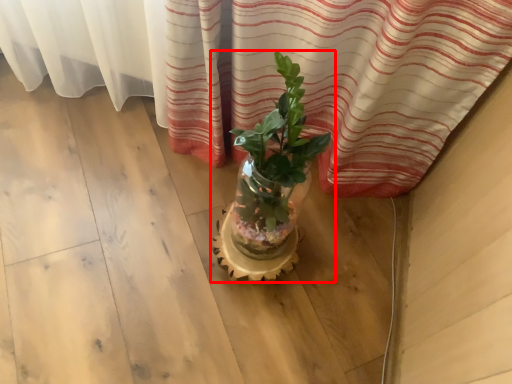
Question: Considering the relative positions of houseplant (annotated by the red box) and flowerpot in the image provided, where is houseplant (annotated by the red box) located with respect to the staircase?

Choices:
 (A) right
 (B) left

Answer: (A)